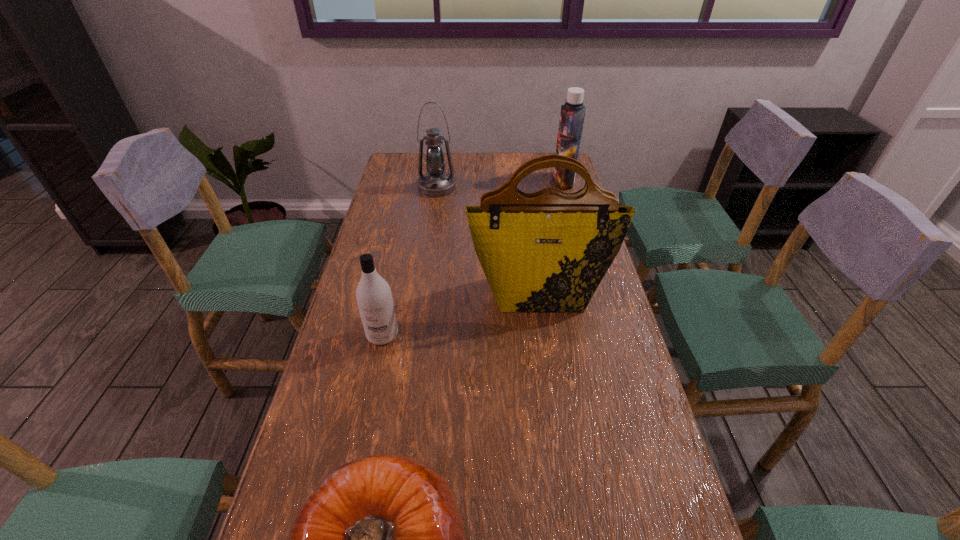
I want to click on vacant area that lies between the oil lamp and the right shampoo, so click(x=500, y=184).

Locate an element on the screen. The width and height of the screenshot is (960, 540). vacant area that lies between the left shampoo and the right shampoo is located at coordinates (473, 258).

Locate an element on the screen. object that is the closest one to the tote bag is located at coordinates (374, 298).

Locate which object ranks in proximity to the shorter shampoo. Please provide its 2D coordinates. Your answer should be formatted as a tuple, i.e. [(x, y)], where the tuple contains the x and y coordinates of a point satisfying the conditions above.

[(547, 251)]

Where is `blank space that satisfies the following two spatial constraints: 1. on the front label of the taller shampoo; 2. on the front side of the oil lamp`? This screenshot has height=540, width=960. blank space that satisfies the following two spatial constraints: 1. on the front label of the taller shampoo; 2. on the front side of the oil lamp is located at coordinates (564, 187).